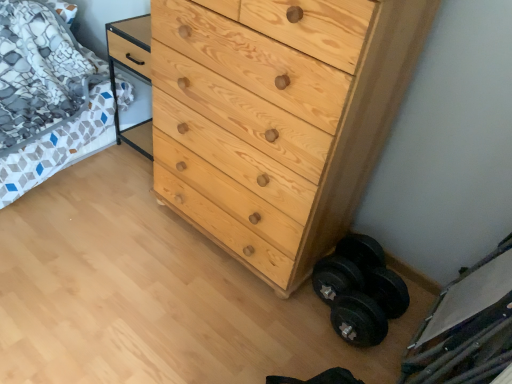
Question: Is natural wood chest of drawers at center in front of or behind black rubber dumbbell at lower right in the image?

Choices:
 (A) front
 (B) behind

Answer: (A)

Question: Would you say natural wood chest of drawers at center is to the left or to the right of black rubber dumbbell at lower right in the picture?

Choices:
 (A) right
 (B) left

Answer: (B)

Question: Which is farther from the patterned fabric bed at left?

Choices:
 (A) black rubber dumbbell at lower right
 (B) natural wood chest of drawers at center

Answer: (A)

Question: Based on their relative distances, which object is farther from the natural wood chest of drawers at center?

Choices:
 (A) black rubber dumbbell at lower right
 (B) patterned fabric bed at left

Answer: (B)